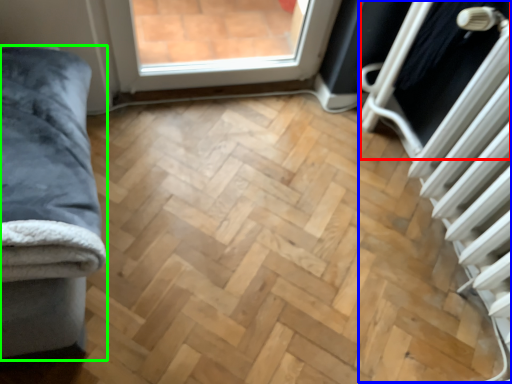
Question: Which is nearer to the screen door (highlighted by a red box)? radiator (highlighted by a blue box) or furniture (highlighted by a green box).

Choices:
 (A) radiator
 (B) furniture

Answer: (A)